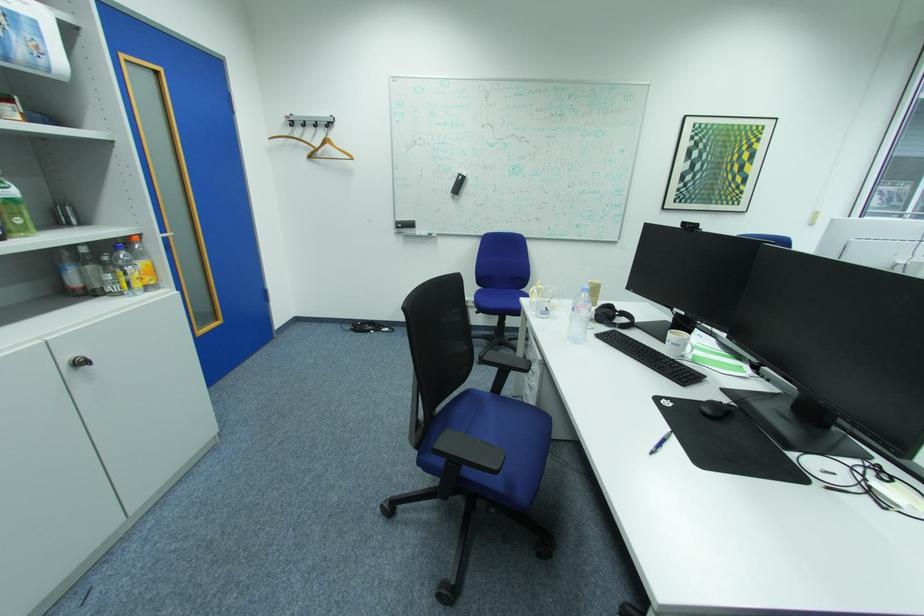
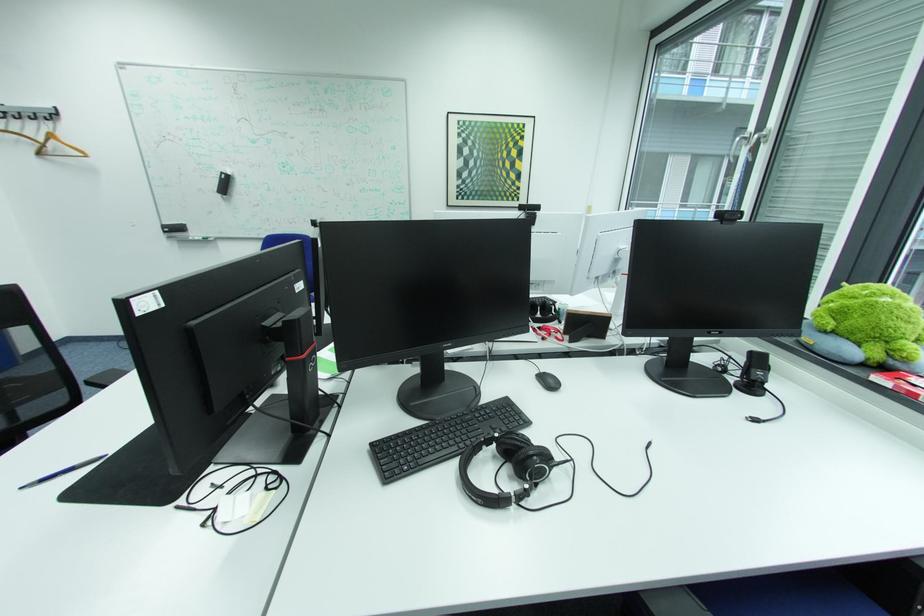
The point at (407, 220) is marked in the first image. Where is the corresponding point in the second image?

(175, 223)